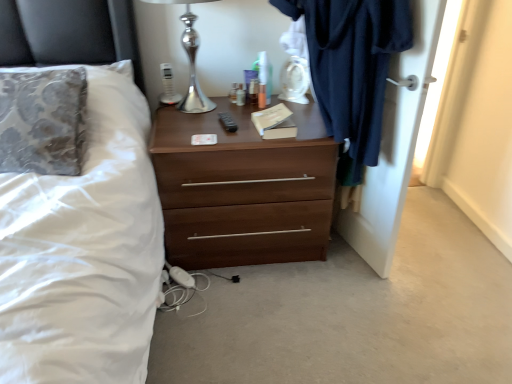
Question: Can you confirm if dark blue fabric at right is bigger than dark blue fabric at right?

Choices:
 (A) yes
 (B) no

Answer: (A)

Question: Is dark blue fabric at right to the left of dark blue fabric at right from the viewer's perspective?

Choices:
 (A) no
 (B) yes

Answer: (B)

Question: Is dark blue fabric at right completely or partially outside of dark blue fabric at right?

Choices:
 (A) no
 (B) yes

Answer: (B)

Question: From the image's perspective, does dark blue fabric at right appear higher than dark blue fabric at right?

Choices:
 (A) no
 (B) yes

Answer: (B)

Question: Does dark blue fabric at right have a lesser height compared to dark blue fabric at right?

Choices:
 (A) yes
 (B) no

Answer: (B)

Question: Is dark blue fabric at right taller than dark blue fabric at right?

Choices:
 (A) yes
 (B) no

Answer: (A)

Question: Does brown wood chest of drawers at center turn towards dark blue fabric at right?

Choices:
 (A) yes
 (B) no

Answer: (B)

Question: Can you confirm if brown wood chest of drawers at center is taller than dark blue fabric at right?

Choices:
 (A) yes
 (B) no

Answer: (B)

Question: Does brown wood chest of drawers at center lie behind dark blue fabric at right?

Choices:
 (A) yes
 (B) no

Answer: (A)

Question: Is brown wood chest of drawers at center to the right of dark blue fabric at right from the viewer's perspective?

Choices:
 (A) yes
 (B) no

Answer: (B)

Question: Does brown wood chest of drawers at center have a greater width compared to dark blue fabric at right?

Choices:
 (A) yes
 (B) no

Answer: (A)

Question: Does brown wood chest of drawers at center appear on the left side of dark blue fabric at right?

Choices:
 (A) yes
 (B) no

Answer: (A)

Question: Considering the relative sizes of dark blue fabric at right and white fabric bed at left in the image provided, is dark blue fabric at right smaller than white fabric bed at left?

Choices:
 (A) no
 (B) yes

Answer: (B)